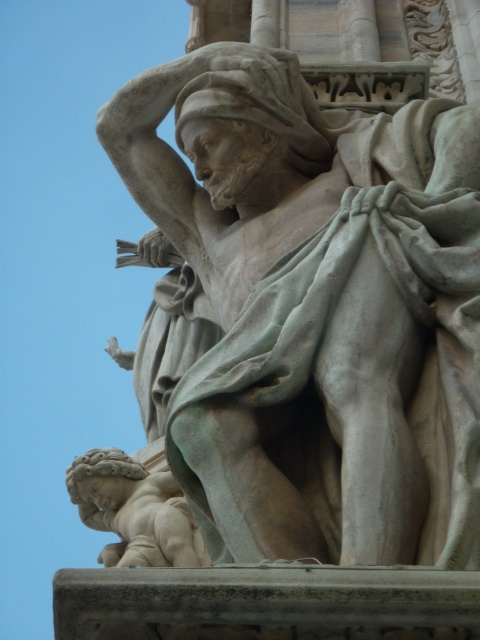
You are an art restorer examining the classical stone sculpture. You notice two points on the sculpture marked at coordinates point (448, 497) and point (83, 458). Which point is nearer to your viewpoint?

Point (448, 497) is closer to the viewer than point (83, 458).